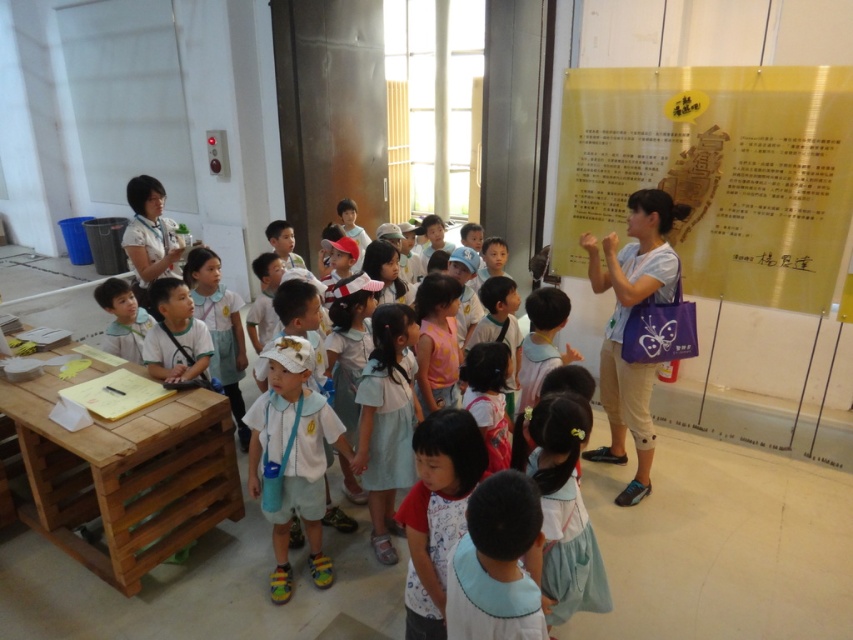
Question: Based on their relative distances, which object is nearer to the gold paper poster at upper right?

Choices:
 (A) white matte hat at center
 (B) white cotton dress at center
 (C) white matte shirt at center

Answer: (B)

Question: Considering the real-world distances, which object is closest to the white matte shirt at center?

Choices:
 (A) gold paper poster at upper right
 (B) purple fabric bag at center
 (C) white cotton dress at center

Answer: (C)

Question: Which point is farther from the camera taking this photo?

Choices:
 (A) (604, 397)
 (B) (314, 467)
 (C) (793, 292)

Answer: (A)

Question: Can you confirm if purple fabric bag at center is positioned to the right of white cotton dress at center?

Choices:
 (A) yes
 (B) no

Answer: (A)

Question: Where is purple fabric bag at center located in relation to white cotton dress at center in the image?

Choices:
 (A) left
 (B) right

Answer: (B)

Question: Does gold paper poster at upper right appear on the left side of white cotton dress at center?

Choices:
 (A) yes
 (B) no

Answer: (B)